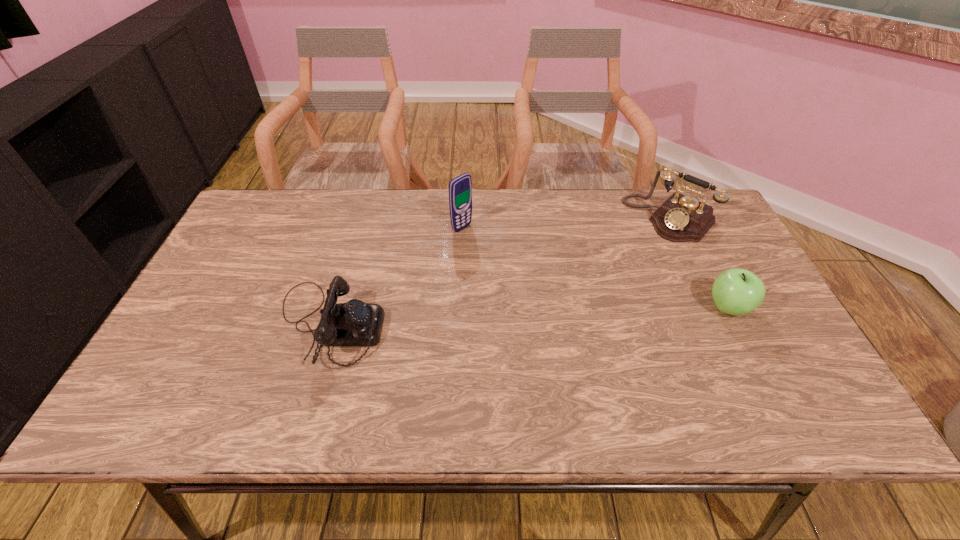
The width and height of the screenshot is (960, 540). In order to click on free space on the desktop that is between the leftmost object and the apple and is positioned on the front-facing side of the third object from right to left in this screenshot , I will do `click(589, 314)`.

Locate an element on the screen. The width and height of the screenshot is (960, 540). vacant spot on the desktop that is between the nearer telephone and the apple and is positioned on the dial of the right telephone is located at coordinates (576, 314).